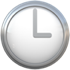
Where is `time of 3:00 on a clock`? time of 3:00 on a clock is located at coordinates (36, 36).